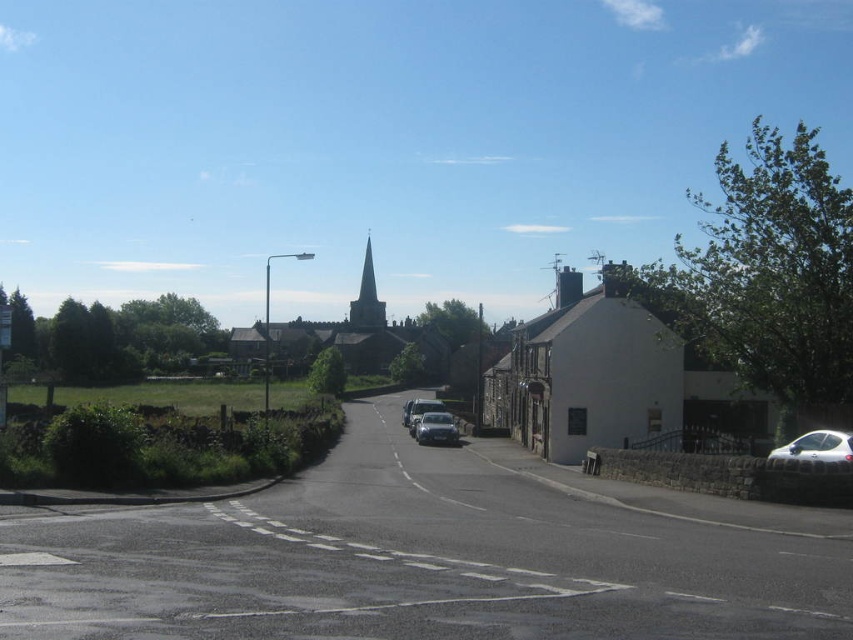
Is white stone spire at center bigger than metallic silver car at center?

Yes.

The image size is (853, 640). Describe the element at coordinates (367, 298) in the screenshot. I see `white stone spire at center` at that location.

You are a GUI agent. You are given a task and a screenshot of the screen. Output one action in this format:
    pyautogui.click(x=<x>, y=<y>)
    Task: Click on the white stone spire at center
    
    Given the screenshot: What is the action you would take?
    pyautogui.click(x=367, y=298)

Can you confirm if gray stone church steeple at center is shorter than white plastic street sign at left?

No.

Does gray stone church steeple at center appear under white plastic street sign at left?

No.

Is point (439, 364) behind point (10, 339)?

Yes, it is.

Image resolution: width=853 pixels, height=640 pixels. Find the location of `gray stone church steeple at center`. gray stone church steeple at center is located at coordinates (349, 336).

Is white stone church at center to the right of white stone spire at center from the viewer's perspective?

Indeed, white stone church at center is positioned on the right side of white stone spire at center.

Does white stone church at center have a greater height compared to white stone spire at center?

In fact, white stone church at center may be shorter than white stone spire at center.

The image size is (853, 640). Describe the element at coordinates (612, 380) in the screenshot. I see `white stone church at center` at that location.

This screenshot has height=640, width=853. Identify the location of white stone church at center. (612, 380).